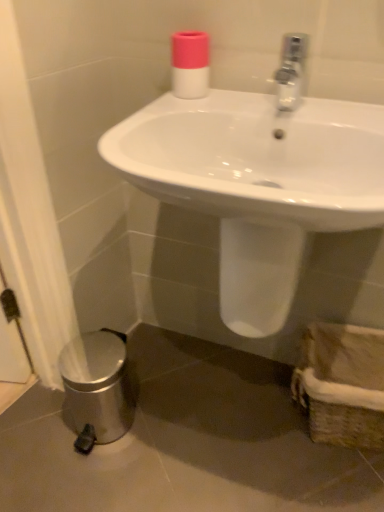
Where is `vacant point to the right of pink matte bottle at upper center`? The image size is (384, 512). vacant point to the right of pink matte bottle at upper center is located at coordinates (266, 98).